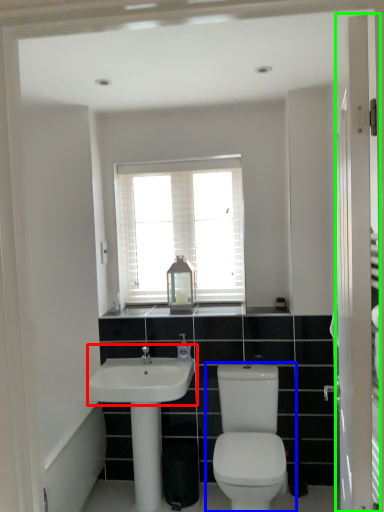
Question: Which object is the farthest from sink (highlighted by a red box)? Choose among these: toilet (highlighted by a blue box) or screen door (highlighted by a green box).

Choices:
 (A) toilet
 (B) screen door

Answer: (B)